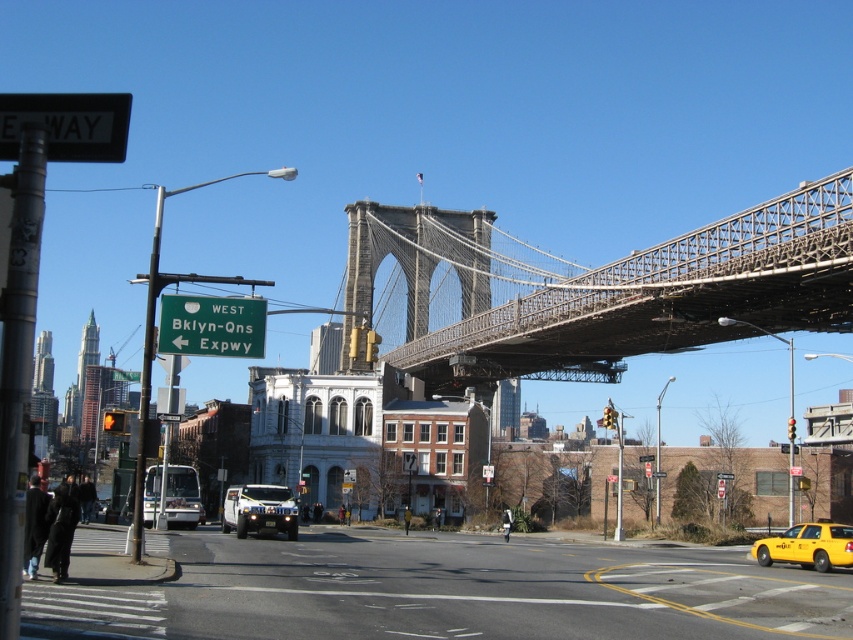
Question: Does yellow rubber at lower right appear over yellow plastic traffic light at center?

Choices:
 (A) no
 (B) yes

Answer: (A)

Question: Among these points, which one is farthest from the camera?

Choices:
 (A) (242, 508)
 (B) (840, 540)
 (C) (514, 609)

Answer: (A)

Question: Does yellow matte taxi at lower right appear over red glass traffic light at upper center?

Choices:
 (A) no
 (B) yes

Answer: (A)

Question: Which point is farther from the camera taking this photo?

Choices:
 (A) (822, 557)
 (B) (788, 440)
 (C) (183, 524)
 (D) (85, 131)

Answer: (B)

Question: Is yellow rubber at lower right further to camera compared to green plastic sign at upper center?

Choices:
 (A) yes
 (B) no

Answer: (B)

Question: Which object is the closest to the yellow rubber at lower right?

Choices:
 (A) red glass traffic light at upper center
 (B) yellow plastic traffic light at center

Answer: (B)